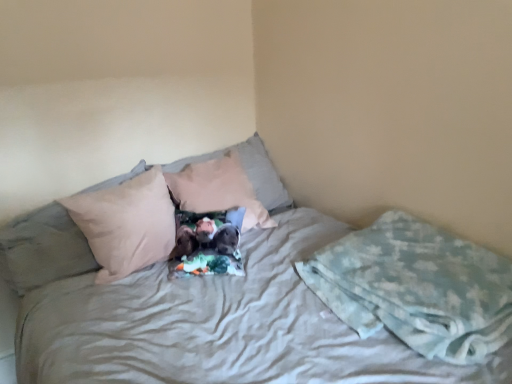
This screenshot has height=384, width=512. What do you see at coordinates (262, 173) in the screenshot?
I see `light brown fabric pillow at center, arranged as the 1th pillow when viewed from the right` at bounding box center [262, 173].

The width and height of the screenshot is (512, 384). What do you see at coordinates (42, 249) in the screenshot?
I see `beige fabric pillow at left, which appears as the 3th pillow when viewed from the right` at bounding box center [42, 249].

What are the coordinates of `beige fabric pillow at left, which appears as the 3th pillow when viewed from the right` in the screenshot? It's located at (42, 249).

You are a GUI agent. You are given a task and a screenshot of the screen. Output one action in this format:
    pyautogui.click(x=<x>, y=<y>)
    Task: Click on the light brown fabric pillow at center, acting as the 3th pillow starting from the left
    
    Given the screenshot: What is the action you would take?
    pyautogui.click(x=262, y=173)

Is light blue textured blanket at lower right positioned with its back to light brown fabric pillow at center, arranged as the 1th pillow when viewed from the right?

No.

Which is behind, light blue textured blanket at lower right or light brown fabric pillow at center, acting as the 3th pillow starting from the left?

light brown fabric pillow at center, acting as the 3th pillow starting from the left, is behind.

From a real-world perspective, is light blue textured blanket at lower right physically located above or below light brown fabric pillow at center, arranged as the 1th pillow when viewed from the right?

In terms of real-world spatial position, light blue textured blanket at lower right is below light brown fabric pillow at center, arranged as the 1th pillow when viewed from the right.

Starting from the light blue textured blanket at lower right, which pillow is the 1st one to the left? Please provide its 2D coordinates.

[(262, 173)]

Considering the sizes of light blue textured blanket at lower right and beige fabric pillow at left, which appears as the 3th pillow when viewed from the right, in the image, is light blue textured blanket at lower right wider or thinner than beige fabric pillow at left, which appears as the 3th pillow when viewed from the right,?

Clearly, light blue textured blanket at lower right has less width compared to beige fabric pillow at left, which appears as the 3th pillow when viewed from the right.

Where is `the 1st pillow directly above the light blue textured blanket at lower right (from a real-world perspective)`? The width and height of the screenshot is (512, 384). the 1st pillow directly above the light blue textured blanket at lower right (from a real-world perspective) is located at coordinates (42, 249).

Is light blue textured blanket at lower right positioned with its back to beige fabric pillow at left, which appears as the 3th pillow when viewed from the right?

No, light blue textured blanket at lower right's orientation is not away from beige fabric pillow at left, which appears as the 3th pillow when viewed from the right.

Is beige fabric pillow at center, which is counted as the second pillow, starting from the left, not near light brown fabric pillow at center, acting as the 3th pillow starting from the left?

No, beige fabric pillow at center, which is counted as the second pillow, starting from the left, is in close proximity to light brown fabric pillow at center, acting as the 3th pillow starting from the left.

From a real-world perspective, relative to light brown fabric pillow at center, acting as the 3th pillow starting from the left, is beige fabric pillow at center, placed as the second pillow when sorted from right to left, vertically above or below?

beige fabric pillow at center, placed as the second pillow when sorted from right to left, is below light brown fabric pillow at center, acting as the 3th pillow starting from the left.

In the image, is beige fabric pillow at center, placed as the second pillow when sorted from right to left, positioned in front of or behind light brown fabric pillow at center, arranged as the 1th pillow when viewed from the right?

beige fabric pillow at center, placed as the second pillow when sorted from right to left, is positioned closer to the viewer than light brown fabric pillow at center, arranged as the 1th pillow when viewed from the right.

Does point (241, 151) come farther from viewer compared to point (272, 171)?

No, it is not.

Is beige fabric pillow at left, which appears as the 3th pillow when viewed from the right, completely or partially outside of light blue textured blanket at lower right?

beige fabric pillow at left, which appears as the 3th pillow when viewed from the right, is positioned outside light blue textured blanket at lower right.

Considering the relative positions of beige fabric pillow at left, which appears as the 3th pillow when viewed from the right, and light blue textured blanket at lower right in the image provided, is beige fabric pillow at left, which appears as the 3th pillow when viewed from the right, to the right of light blue textured blanket at lower right from the viewer's perspective?

No.

Can you see beige fabric pillow at left, which appears as the first pillow when viewed from the left, touching light blue textured blanket at lower right?

No.

Is beige fabric pillow at left, which appears as the first pillow when viewed from the left, taller than light blue textured blanket at lower right?

Yes, beige fabric pillow at left, which appears as the first pillow when viewed from the left, is taller than light blue textured blanket at lower right.

Does beige fabric pillow at left, which appears as the 3th pillow when viewed from the right, have a smaller size compared to beige fabric pillow at center, which is counted as the second pillow, starting from the left?

Yes, beige fabric pillow at left, which appears as the 3th pillow when viewed from the right, is smaller than beige fabric pillow at center, which is counted as the second pillow, starting from the left.

How different are the orientations of beige fabric pillow at left, which appears as the 3th pillow when viewed from the right, and beige fabric pillow at center, placed as the second pillow when sorted from right to left, in degrees?

The angular difference between beige fabric pillow at left, which appears as the 3th pillow when viewed from the right, and beige fabric pillow at center, placed as the second pillow when sorted from right to left, is 78.2 degrees.

Considering the relative sizes of beige fabric pillow at left, which appears as the first pillow when viewed from the left, and beige fabric pillow at center, which is counted as the second pillow, starting from the left, in the image provided, is beige fabric pillow at left, which appears as the first pillow when viewed from the left, wider than beige fabric pillow at center, which is counted as the second pillow, starting from the left,?

Yes, beige fabric pillow at left, which appears as the first pillow when viewed from the left, is wider than beige fabric pillow at center, which is counted as the second pillow, starting from the left.

Is light brown fabric pillow at center, arranged as the 1th pillow when viewed from the right, behind beige fabric pillow at center, which is counted as the second pillow, starting from the left?

Yes, light brown fabric pillow at center, arranged as the 1th pillow when viewed from the right, is further from the viewer.

Which object is positioned more to the left, light brown fabric pillow at center, arranged as the 1th pillow when viewed from the right, or beige fabric pillow at center, placed as the second pillow when sorted from right to left?

beige fabric pillow at center, placed as the second pillow when sorted from right to left.

How many degrees apart are the facing directions of light brown fabric pillow at center, arranged as the 1th pillow when viewed from the right, and beige fabric pillow at center, placed as the second pillow when sorted from right to left?

They differ by 77.5 degrees in their facing directions.

Considering the relative sizes of light brown fabric pillow at center, arranged as the 1th pillow when viewed from the right, and beige fabric pillow at center, placed as the second pillow when sorted from right to left, in the image provided, is light brown fabric pillow at center, arranged as the 1th pillow when viewed from the right, bigger than beige fabric pillow at center, placed as the second pillow when sorted from right to left,?

No, light brown fabric pillow at center, arranged as the 1th pillow when viewed from the right, is not bigger than beige fabric pillow at center, placed as the second pillow when sorted from right to left.

Looking at this image, is light blue textured blanket at lower right not near beige fabric pillow at center, which is counted as the second pillow, starting from the left?

That's right, there is a large distance between light blue textured blanket at lower right and beige fabric pillow at center, which is counted as the second pillow, starting from the left.

Which point is more forward, (511, 297) or (44, 248)?

The point (511, 297) is closer.

Between light blue textured blanket at lower right and beige fabric pillow at center, placed as the second pillow when sorted from right to left, which one has larger size?

With larger size is beige fabric pillow at center, placed as the second pillow when sorted from right to left.

Image resolution: width=512 pixels, height=384 pixels. I want to click on pillow that is the 3rd object located behind the light blue textured blanket at lower right, so click(262, 173).

From the image's perspective, which pillow is the 2nd one above the light blue textured blanket at lower right? Please provide its 2D coordinates.

[(42, 249)]

Based on their spatial positions, is beige fabric pillow at center, placed as the second pillow when sorted from right to left, or beige fabric pillow at left, which appears as the 3th pillow when viewed from the right, further from light blue textured blanket at lower right?

beige fabric pillow at center, placed as the second pillow when sorted from right to left, is further to light blue textured blanket at lower right.

From the image, which object appears to be farther from beige fabric pillow at center, placed as the second pillow when sorted from right to left, beige fabric pillow at left, which appears as the first pillow when viewed from the left, or light blue textured blanket at lower right?

The object further to beige fabric pillow at center, placed as the second pillow when sorted from right to left, is light blue textured blanket at lower right.

Which object lies further to the anchor point light brown fabric pillow at center, acting as the 3th pillow starting from the left, light blue textured blanket at lower right or beige fabric pillow at left, which appears as the first pillow when viewed from the left?

Based on the image, light blue textured blanket at lower right appears to be further to light brown fabric pillow at center, acting as the 3th pillow starting from the left.

Estimate the real-world distances between objects in this image. Which object is closer to beige fabric pillow at center, placed as the second pillow when sorted from right to left, light brown fabric pillow at center, acting as the 3th pillow starting from the left, or light blue textured blanket at lower right?

light brown fabric pillow at center, acting as the 3th pillow starting from the left, lies closer to beige fabric pillow at center, placed as the second pillow when sorted from right to left, than the other object.

Looking at the image, which one is located closer to light blue textured blanket at lower right, beige fabric pillow at center, which is counted as the second pillow, starting from the left, or light brown fabric pillow at center, acting as the 3th pillow starting from the left?

Among the two, light brown fabric pillow at center, acting as the 3th pillow starting from the left, is located nearer to light blue textured blanket at lower right.

Considering their positions, is light blue textured blanket at lower right positioned further to beige fabric pillow at left, which appears as the first pillow when viewed from the left, than light brown fabric pillow at center, arranged as the 1th pillow when viewed from the right?

light blue textured blanket at lower right lies further to beige fabric pillow at left, which appears as the first pillow when viewed from the left, than the other object.

From the picture: Looking at the image, which one is located further to light brown fabric pillow at center, arranged as the 1th pillow when viewed from the right, beige fabric pillow at center, which is counted as the second pillow, starting from the left, or light blue textured blanket at lower right?

light blue textured blanket at lower right.

Which object lies nearer to the anchor point beige fabric pillow at center, which is counted as the second pillow, starting from the left, light brown fabric pillow at center, arranged as the 1th pillow when viewed from the right, or beige fabric pillow at left, which appears as the first pillow when viewed from the left?

Based on the image, beige fabric pillow at left, which appears as the first pillow when viewed from the left, appears to be nearer to beige fabric pillow at center, which is counted as the second pillow, starting from the left.

This screenshot has height=384, width=512. Find the location of `pillow situated between beige fabric pillow at left, which appears as the first pillow when viewed from the left, and light brown fabric pillow at center, arranged as the 1th pillow when viewed from the right, from left to right`. pillow situated between beige fabric pillow at left, which appears as the first pillow when viewed from the left, and light brown fabric pillow at center, arranged as the 1th pillow when viewed from the right, from left to right is located at coordinates (42, 249).

The height and width of the screenshot is (384, 512). I want to click on pillow between beige fabric pillow at center, which is counted as the second pillow, starting from the left, and light blue textured blanket at lower right, in the horizontal direction, so click(x=262, y=173).